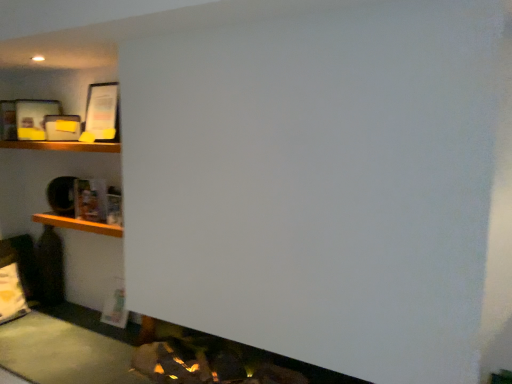
Question: Is wooden shelf at upper left taller or shorter than wooden shelf at left?

Choices:
 (A) short
 (B) tall

Answer: (A)

Question: In terms of size, does wooden shelf at upper left appear bigger or smaller than wooden shelf at left?

Choices:
 (A) small
 (B) big

Answer: (B)

Question: Relative to wooden shelf at left, is wooden shelf at upper left in front or behind?

Choices:
 (A) front
 (B) behind

Answer: (A)

Question: Does point (98, 225) appear closer or farther from the camera than point (83, 147)?

Choices:
 (A) farther
 (B) closer

Answer: (B)

Question: In terms of size, does wooden shelf at left appear bigger or smaller than wooden shelf at upper left?

Choices:
 (A) small
 (B) big

Answer: (A)

Question: Considering the relative positions of wooden shelf at left and wooden shelf at upper left in the image provided, is wooden shelf at left to the left or to the right of wooden shelf at upper left?

Choices:
 (A) right
 (B) left

Answer: (A)

Question: Relative to wooden shelf at upper left, is wooden shelf at left in front or behind?

Choices:
 (A) front
 (B) behind

Answer: (B)